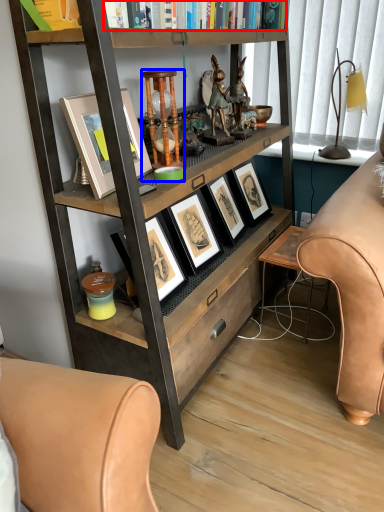
Question: Which object appears farthest to the camera in this image, book (highlighted by a red box) or bar stool (highlighted by a blue box)?

Choices:
 (A) book
 (B) bar stool

Answer: (B)